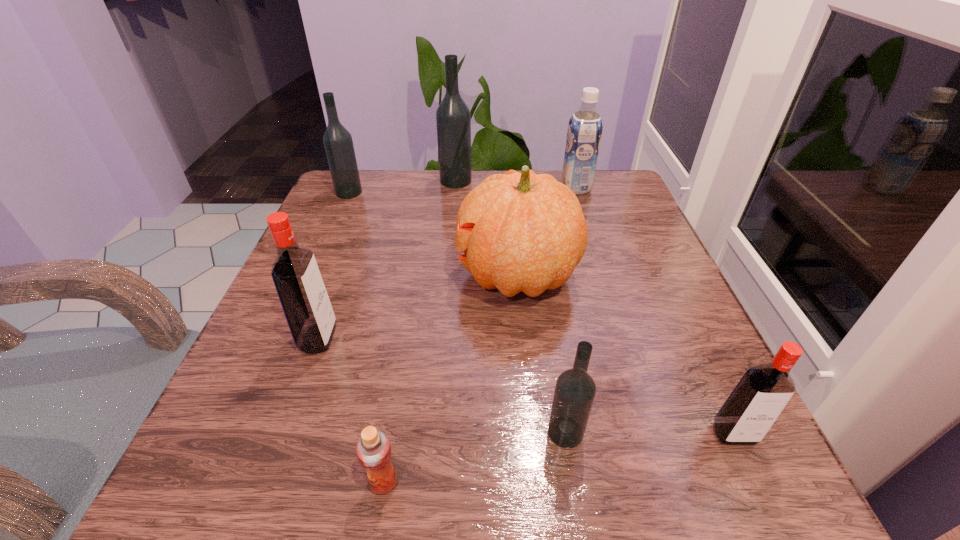
The height and width of the screenshot is (540, 960). Identify the location of empty space between the pumpkin and the third nearest vodka. (418, 306).

This screenshot has height=540, width=960. Identify the location of free space between the second biggest black vodka and the third vodka from left to right. (402, 186).

Identify the location of vacant point located between the nearest black vodka and the soya milk. This screenshot has width=960, height=540. (570, 310).

I want to click on free space between the shortest object and the tallest vodka, so click(420, 332).

This screenshot has width=960, height=540. What are the coordinates of `free space between the rightmost object and the leftmost black vodka` in the screenshot? It's located at (541, 313).

At what (x,y) coordinates should I click in order to perform the action: click on unoccupied area between the orange juice and the nearer red vodka. Please return your answer as a coordinate pair (x, y). The width and height of the screenshot is (960, 540). Looking at the image, I should click on (559, 458).

Find the location of a particular element. This screenshot has height=540, width=960. free spot between the biggest black vodka and the fourth vodka from left to right is located at coordinates (511, 307).

Find the location of `vacant space that is in between the biggest black vodka and the farther red vodka`. vacant space that is in between the biggest black vodka and the farther red vodka is located at coordinates (387, 260).

Locate which object is the third closest to the orange pumpkin. Please provide its 2D coordinates. Your answer should be formatted as a tuple, i.e. [(x, y)], where the tuple contains the x and y coordinates of a point satisfying the conditions above.

[(295, 273)]

What are the coordinates of `object that stands as the fourth closest to the seventh object from left to right` in the screenshot? It's located at (575, 390).